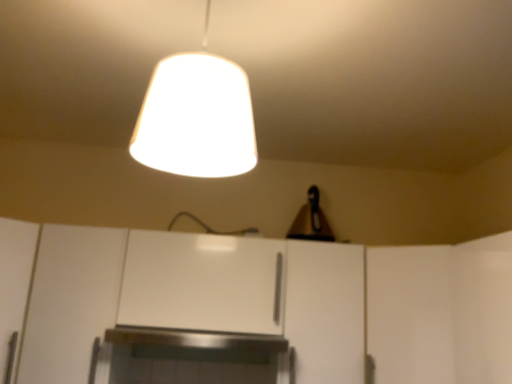
Question: Can you confirm if white matte cabinet at center, which ranks as the 2th cabinetry in right-to-left order, is thinner than white matte cabinet at center, which ranks as the third cabinetry in left-to-right order?

Choices:
 (A) no
 (B) yes

Answer: (B)

Question: Is white matte cabinet at center, placed as the 2th cabinetry when sorted from left to right, bigger than white matte cabinet at center, which is counted as the first cabinetry, starting from the right?

Choices:
 (A) yes
 (B) no

Answer: (B)

Question: Is the depth of white matte cabinet at center, which ranks as the 2th cabinetry in right-to-left order, less than that of white matte cabinet at center, which is counted as the first cabinetry, starting from the right?

Choices:
 (A) yes
 (B) no

Answer: (B)

Question: Does white matte cabinet at center, placed as the 2th cabinetry when sorted from left to right, have a lesser height compared to white matte cabinet at center, which ranks as the third cabinetry in left-to-right order?

Choices:
 (A) no
 (B) yes

Answer: (B)

Question: Is white matte cabinet at center, placed as the 2th cabinetry when sorted from left to right, taller than white matte cabinet at center, which is counted as the first cabinetry, starting from the right?

Choices:
 (A) yes
 (B) no

Answer: (B)

Question: Is white matte cabinet at center, which ranks as the third cabinetry in left-to-right order, completely or partially inside white matte cabinet at center, placed as the 2th cabinetry when sorted from left to right?

Choices:
 (A) no
 (B) yes

Answer: (A)

Question: Does white matte cabinet at lower left, which is counted as the 3th cabinetry, starting from the right, have a larger size compared to white matte cabinet at center, placed as the 2th cabinetry when sorted from left to right?

Choices:
 (A) yes
 (B) no

Answer: (A)

Question: Is white matte cabinet at lower left, placed as the 1th cabinetry when sorted from left to right, thinner than white matte cabinet at center, which ranks as the 2th cabinetry in right-to-left order?

Choices:
 (A) no
 (B) yes

Answer: (B)

Question: Is white matte cabinet at lower left, which is counted as the 3th cabinetry, starting from the right, next to white matte cabinet at center, placed as the 2th cabinetry when sorted from left to right, and touching it?

Choices:
 (A) no
 (B) yes

Answer: (A)

Question: Is white matte cabinet at lower left, which is counted as the 3th cabinetry, starting from the right, positioned beyond the bounds of white matte cabinet at center, placed as the 2th cabinetry when sorted from left to right?

Choices:
 (A) no
 (B) yes

Answer: (B)

Question: From the image's perspective, is white matte cabinet at lower left, which is counted as the 3th cabinetry, starting from the right, beneath white matte cabinet at center, which ranks as the 2th cabinetry in right-to-left order?

Choices:
 (A) yes
 (B) no

Answer: (A)

Question: From a real-world perspective, is white matte cabinet at lower left, which is counted as the 3th cabinetry, starting from the right, located higher than white matte cabinet at center, placed as the 2th cabinetry when sorted from left to right?

Choices:
 (A) yes
 (B) no

Answer: (B)

Question: Considering the relative sizes of white matte cabinet at lower left, placed as the 1th cabinetry when sorted from left to right, and white matte lampshade at upper center in the image provided, is white matte cabinet at lower left, placed as the 1th cabinetry when sorted from left to right, bigger than white matte lampshade at upper center?

Choices:
 (A) yes
 (B) no

Answer: (A)